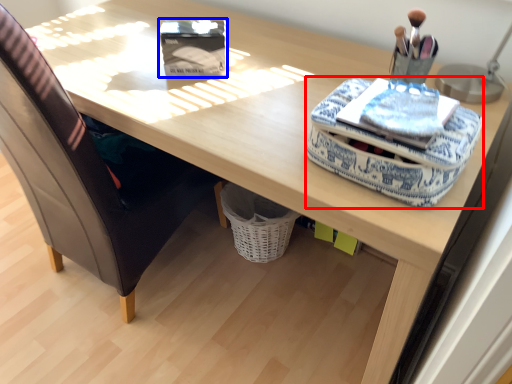
Question: Which point is closer to the camera, material (highlighted by a red box) or storage box (highlighted by a blue box)?

Choices:
 (A) material
 (B) storage box

Answer: (A)